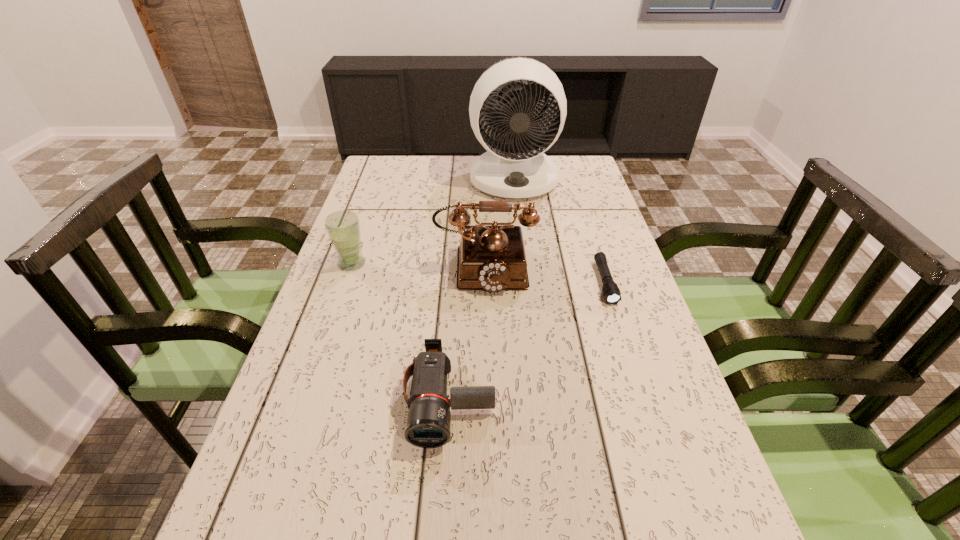
This screenshot has width=960, height=540. I want to click on the tallest object, so click(517, 170).

Image resolution: width=960 pixels, height=540 pixels. I want to click on fan, so click(x=517, y=170).

Where is `the second tallest object`? Image resolution: width=960 pixels, height=540 pixels. the second tallest object is located at coordinates (492, 258).

This screenshot has width=960, height=540. What are the coordinates of `the third shortest object` in the screenshot? It's located at (343, 227).

Image resolution: width=960 pixels, height=540 pixels. Identify the location of glass. (343, 227).

Where is `the second shortest object`? Image resolution: width=960 pixels, height=540 pixels. the second shortest object is located at coordinates (428, 424).

I want to click on the nearest object, so click(x=428, y=424).

You are a GUI agent. You are given a task and a screenshot of the screen. Output one action in this format:
    pyautogui.click(x=<x>, y=<y>)
    Task: Click on the flashlight
    
    Given the screenshot: What is the action you would take?
    pyautogui.click(x=611, y=292)

Find the location of a particular element. the rightmost object is located at coordinates (611, 292).

In order to click on vacant area located 0.170m on the grille of the fan in this screenshot , I will do `click(520, 234)`.